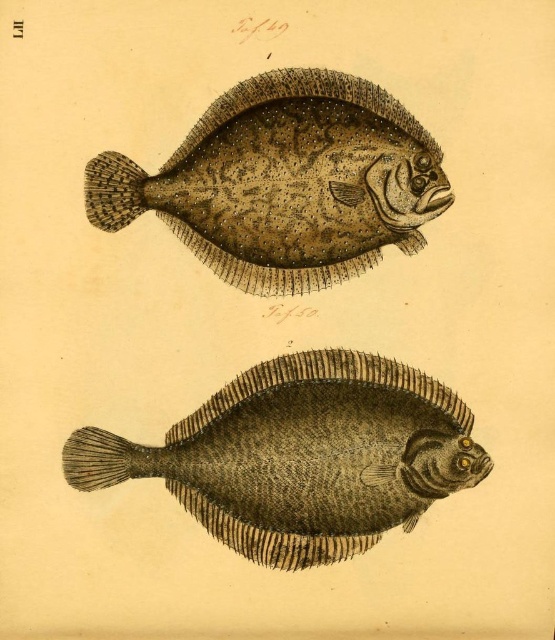
Based on the scene description, where is the brown textured fish at center located in terms of coordinates?

The brown textured fish at center is located at point (302, 456).

Looking at the two fish in the image, the brown textured fish at center and the speckled textured fish at upper center, which one is positioned to the right of the other?

The brown textured fish at center is positioned to the right of the speckled textured fish at upper center.